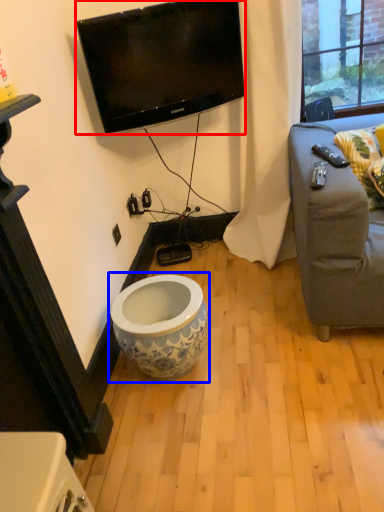
Question: Among these objects, which one is nearest to the camera, television (highlighted by a red box) or toilet (highlighted by a blue box)?

Choices:
 (A) television
 (B) toilet

Answer: (B)